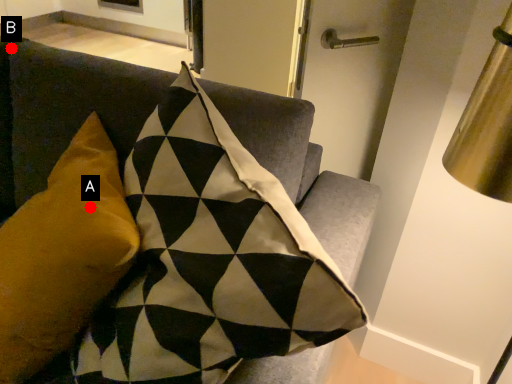
Question: Two points are circled on the image, labeled by A and B beside each circle. Which point appears farthest from the camera in this image?

Choices:
 (A) A is further
 (B) B is further

Answer: (B)